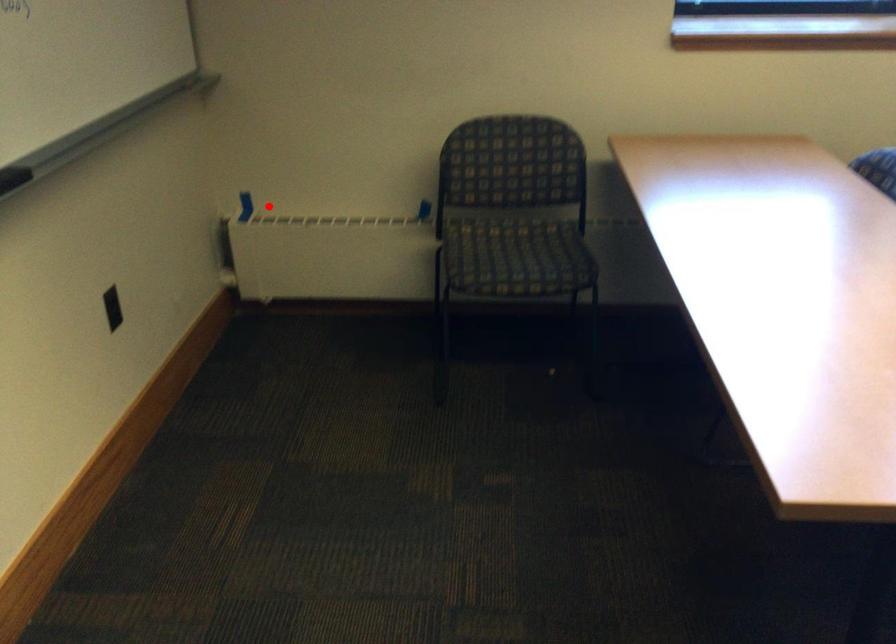
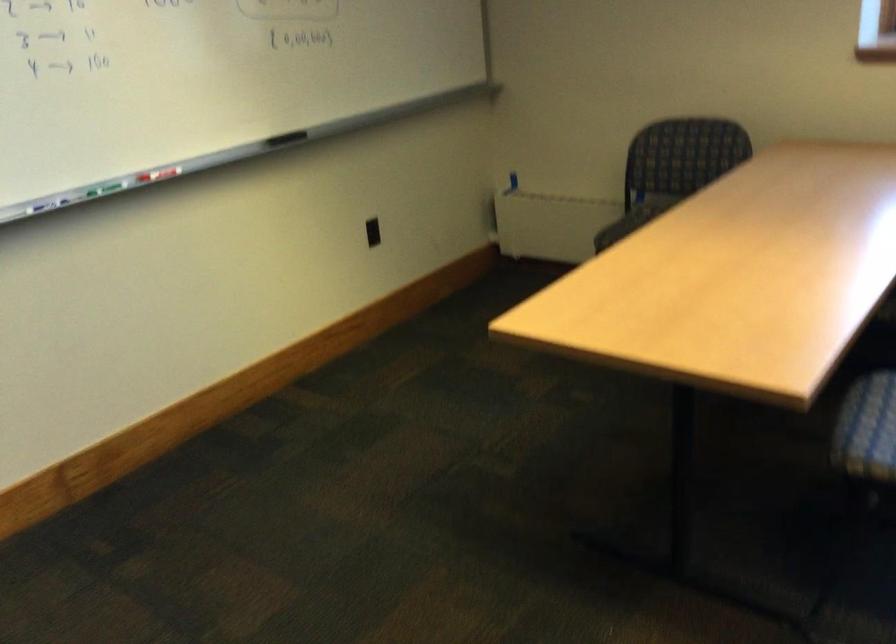
Question: I am providing you with two images of the same scene from different viewpoints. In image1, a red point is highlighted. Considering the same 3D point in image2, which of the following is correct?

Choices:
 (A) It is closer
 (B) It is farther

Answer: (B)